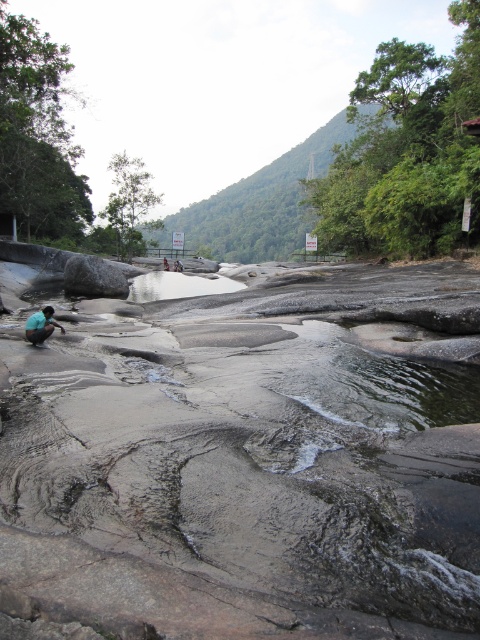
Question: Which point appears closest to the camera in this image?

Choices:
 (A) (110, 262)
 (B) (137, 276)
 (C) (49, 320)

Answer: (C)

Question: Is smooth brown mud at center behind teal fabric squat at lower left?

Choices:
 (A) yes
 (B) no

Answer: (B)

Question: Is clear glass puddle at center thinner than gray rough rock at center?

Choices:
 (A) yes
 (B) no

Answer: (B)

Question: Which point is closer to the camera?

Choices:
 (A) gray rough rock at center
 (B) clear glass puddle at center
 (C) smooth brown mud at center

Answer: (C)

Question: Which object appears farthest from the camera in this image?

Choices:
 (A) clear glass puddle at center
 (B) gray rough rock at center

Answer: (A)

Question: Is smooth brown mud at center to the right of clear glass puddle at center from the viewer's perspective?

Choices:
 (A) no
 (B) yes

Answer: (B)